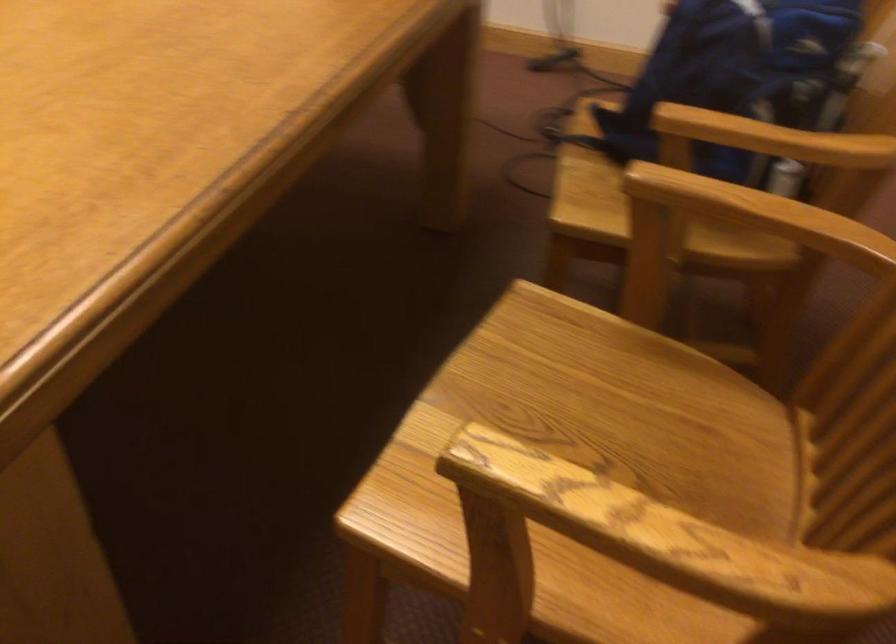
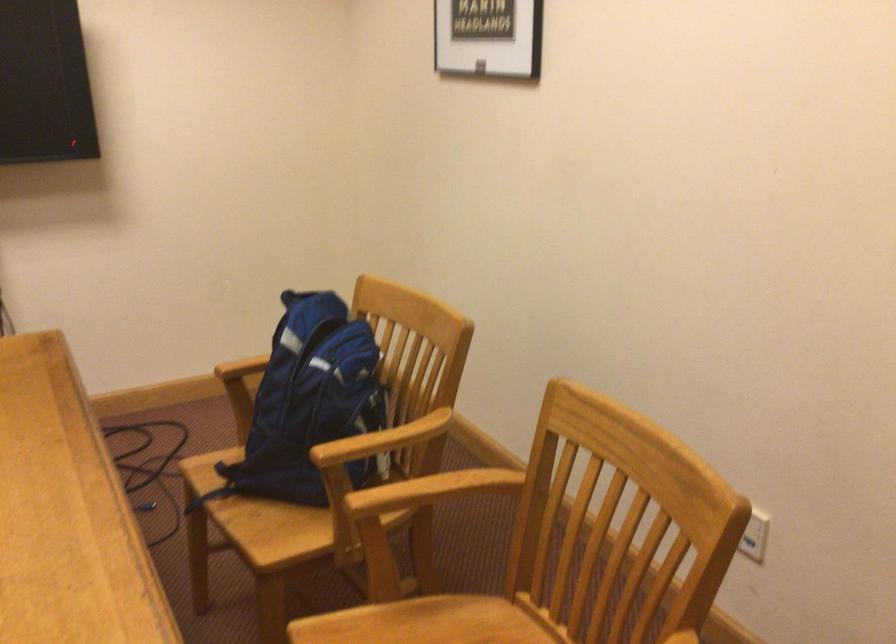
The point at (762, 214) is marked in the first image. Where is the corresponding point in the second image?

(436, 488)